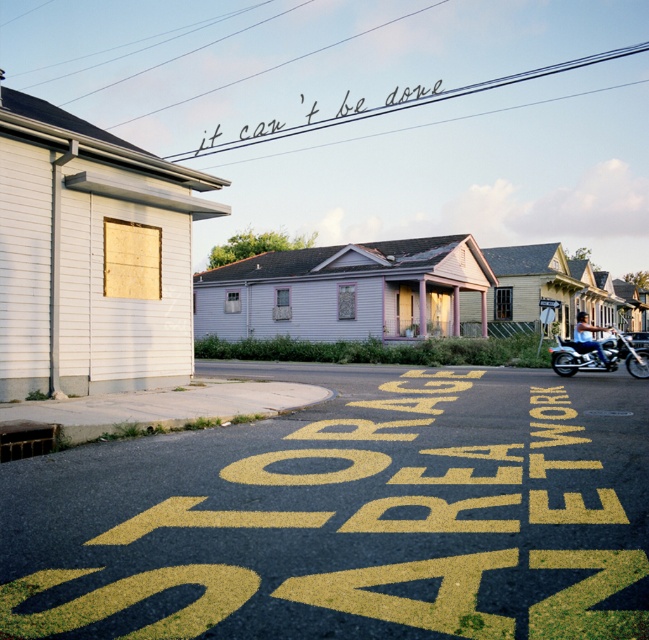
Question: Does shiny chrome motorcycle at right have a larger size compared to black ink writing at upper center?

Choices:
 (A) no
 (B) yes

Answer: (A)

Question: Is yellow asphalt at center closer to camera compared to shiny chrome motorcycle at right?

Choices:
 (A) no
 (B) yes

Answer: (B)

Question: Considering the real-world distances, which object is closest to the yellow asphalt at center?

Choices:
 (A) black ink writing at upper center
 (B) shiny chrome motorcycle at right

Answer: (B)

Question: Considering the real-world distances, which object is farthest from the black ink writing at upper center?

Choices:
 (A) yellow asphalt at center
 (B) shiny chrome motorcycle at right

Answer: (A)

Question: Which of the following is the closest to the observer?

Choices:
 (A) (417, 88)
 (B) (613, 330)
 (C) (382, 604)

Answer: (C)

Question: Is yellow asphalt at center closer to camera compared to shiny chrome motorcycle at right?

Choices:
 (A) yes
 (B) no

Answer: (A)